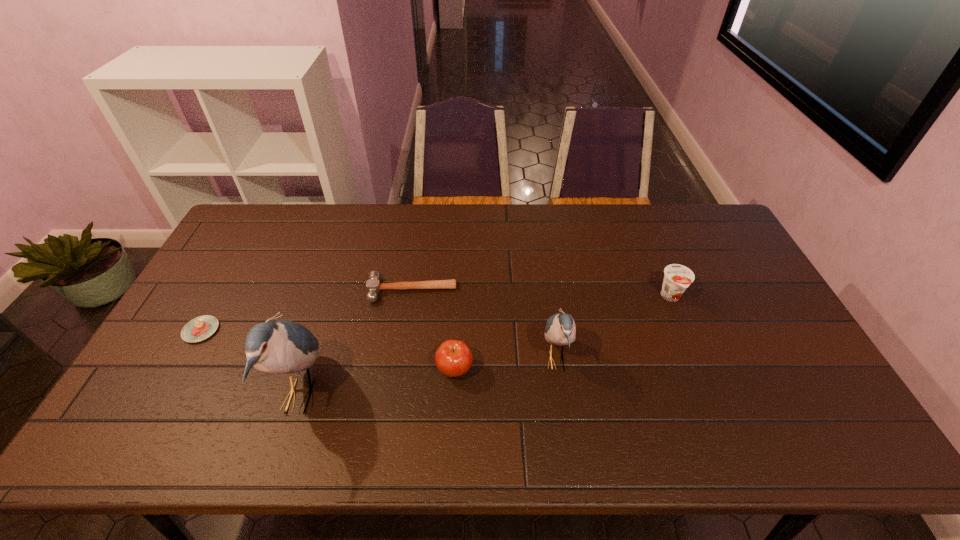
The width and height of the screenshot is (960, 540). What are the coordinates of `free point that keeps the birds evenly spaced on the right` in the screenshot? It's located at (782, 329).